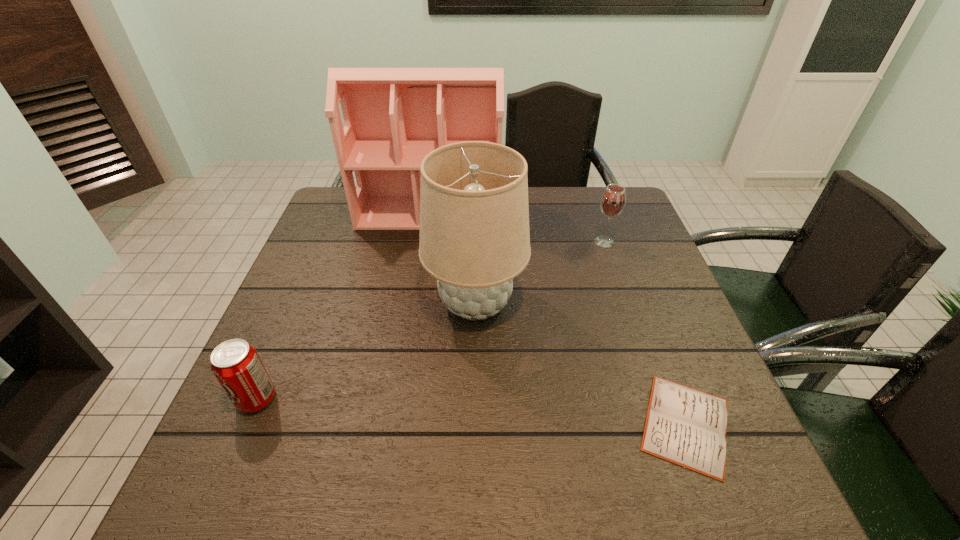
Locate an element on the screen. Image resolution: width=960 pixels, height=540 pixels. free spot between the fourth tallest object and the dollhouse is located at coordinates (343, 306).

The image size is (960, 540). I want to click on free area in between the diary and the leftmost object, so click(x=471, y=412).

Identify the location of free space between the soda and the second farthest object. Image resolution: width=960 pixels, height=540 pixels. (430, 321).

Identify the location of vacant space that's between the soda and the farthest object. The width and height of the screenshot is (960, 540). (343, 306).

The image size is (960, 540). Find the location of `vacant space that's between the soda and the shortest object`. vacant space that's between the soda and the shortest object is located at coordinates (471, 412).

Locate an element on the screen. object identified as the closest to the fourth tallest object is located at coordinates (474, 239).

Image resolution: width=960 pixels, height=540 pixels. Identify the location of object identified as the closest to the shortest object. (474, 239).

Identify the location of vacant space that satisfies the following two spatial constraints: 1. on the front-facing side of the fourth nearest object; 2. on the left side of the dollhouse. (424, 242).

Where is `free space that satisfies the following two spatial constraints: 1. on the front-facing side of the diary; 2. on the left side of the farthest object`? free space that satisfies the following two spatial constraints: 1. on the front-facing side of the diary; 2. on the left side of the farthest object is located at coordinates (396, 424).

This screenshot has width=960, height=540. I want to click on free space that satisfies the following two spatial constraints: 1. on the front-facing side of the lampshade; 2. on the left side of the farthest object, so click(x=415, y=303).